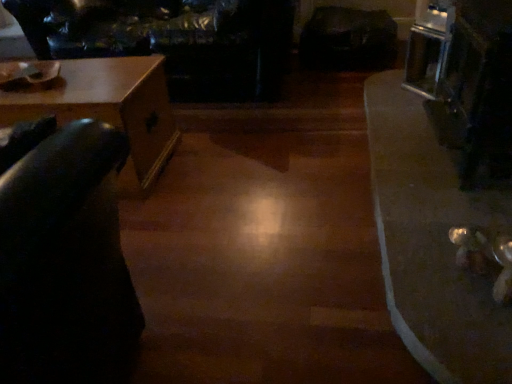
Locate an element on the screen. This screenshot has width=512, height=384. leather couch at upper left is located at coordinates (172, 40).

The width and height of the screenshot is (512, 384). What are the coordinates of `wooden table at left, the first table from the left` in the screenshot? It's located at (109, 109).

Is shiny metallic table at lower right, the 1th table from the right, positioned beyond the bounds of leather couch at upper left?

Yes, shiny metallic table at lower right, the 1th table from the right, is outside of leather couch at upper left.

Measure the distance between shiny metallic table at lower right, the 1th table from the right, and leather couch at upper left.

A distance of 4.32 feet exists between shiny metallic table at lower right, the 1th table from the right, and leather couch at upper left.

Is shiny metallic table at lower right, the 1th table from the right, facing away from leather couch at upper left?

That's not correct — shiny metallic table at lower right, the 1th table from the right, is not looking away from leather couch at upper left.

Does shiny metallic table at lower right, the 1th table from the right, lie behind leather couch at upper left?

No.

Measure the distance from wooden table at left, the first table from the left, to leather couch at upper left.

wooden table at left, the first table from the left, is 25.36 inches away from leather couch at upper left.

Is wooden table at left, which is the second table from right to left, positioned beyond the bounds of leather couch at upper left?

Yes, wooden table at left, which is the second table from right to left, is outside of leather couch at upper left.

Looking at this image, considering the relative positions of wooden table at left, which is the second table from right to left, and leather couch at upper left in the image provided, is wooden table at left, which is the second table from right to left, to the left or to the right of leather couch at upper left?

In the image, wooden table at left, which is the second table from right to left, appears on the left side of leather couch at upper left.

Who is more distant, wooden table at left, the first table from the left, or leather couch at upper left?

leather couch at upper left is further away from the camera.

Is shiny metallic table at lower right, placed as the second table when sorted from left to right, bigger than wooden table at left, which is the second table from right to left?

No.

From the image's perspective, which one is positioned lower, shiny metallic table at lower right, the 1th table from the right, or wooden table at left, which is the second table from right to left?

shiny metallic table at lower right, the 1th table from the right, from the image's perspective.

Between shiny metallic table at lower right, placed as the second table when sorted from left to right, and wooden table at left, the first table from the left, which one appears on the right side from the viewer's perspective?

shiny metallic table at lower right, placed as the second table when sorted from left to right, is more to the right.

What's the angular difference between wooden table at left, the first table from the left, and shiny metallic table at lower right, the 1th table from the right,'s facing directions?

The angle between the facing direction of wooden table at left, the first table from the left, and the facing direction of shiny metallic table at lower right, the 1th table from the right, is 89.2 degrees.

In terms of size, does wooden table at left, the first table from the left, appear bigger or smaller than shiny metallic table at lower right, placed as the second table when sorted from left to right?

Clearly, wooden table at left, the first table from the left, is larger in size than shiny metallic table at lower right, placed as the second table when sorted from left to right.

Is point (146, 90) behind point (437, 151)?

No.

Can you confirm if wooden table at left, the first table from the left, is shorter than shiny metallic table at lower right, the 1th table from the right?

No.

Is leather couch at upper left wider than wooden table at left, the first table from the left?

Correct, the width of leather couch at upper left exceeds that of wooden table at left, the first table from the left.

From the image's perspective, between leather couch at upper left and wooden table at left, which is the second table from right to left, which one is located above?

From the image's view, leather couch at upper left is above.

Is leather couch at upper left oriented towards wooden table at left, which is the second table from right to left?

Yes, leather couch at upper left is oriented towards wooden table at left, which is the second table from right to left.

From the picture: Who is bigger, leather couch at upper left or wooden table at left, the first table from the left?

With larger size is leather couch at upper left.

Between leather couch at upper left and shiny metallic table at lower right, placed as the second table when sorted from left to right, which one appears on the left side from the viewer's perspective?

Positioned to the left is leather couch at upper left.

Where is `couch behind the shiny metallic table at lower right, the 1th table from the right`? Image resolution: width=512 pixels, height=384 pixels. couch behind the shiny metallic table at lower right, the 1th table from the right is located at coordinates (172, 40).

Is point (36, 38) more distant than point (438, 237)?

Yes, point (36, 38) is behind point (438, 237).

In the scene shown: From a real-world perspective, relative to shiny metallic table at lower right, the 1th table from the right, is leather couch at upper left vertically above or below?

leather couch at upper left is above shiny metallic table at lower right, the 1th table from the right.

Where is `couch above the shiny metallic table at lower right, placed as the second table when sorted from left to right (from a real-world perspective)`? couch above the shiny metallic table at lower right, placed as the second table when sorted from left to right (from a real-world perspective) is located at coordinates (172, 40).

Locate an element on the screen. table to the left of leather couch at upper left is located at coordinates (109, 109).

When comparing their distances from shiny metallic table at lower right, placed as the second table when sorted from left to right, does wooden table at left, which is the second table from right to left, or leather couch at upper left seem further?

Based on the image, leather couch at upper left appears to be further to shiny metallic table at lower right, placed as the second table when sorted from left to right.

Looking at the image, which one is located closer to leather couch at upper left, shiny metallic table at lower right, the 1th table from the right, or wooden table at left, which is the second table from right to left?

wooden table at left, which is the second table from right to left.

Based on their spatial positions, is leather couch at upper left or shiny metallic table at lower right, placed as the second table when sorted from left to right, closer to wooden table at left, the first table from the left?

leather couch at upper left is positioned closer to the anchor wooden table at left, the first table from the left.

Looking at this image, estimate the real-world distances between objects in this image. Which object is closer to leather couch at upper left, wooden table at left, which is the second table from right to left, or shiny metallic table at lower right, the 1th table from the right?

Based on the image, wooden table at left, which is the second table from right to left, appears to be nearer to leather couch at upper left.

Which object lies nearer to the anchor point shiny metallic table at lower right, placed as the second table when sorted from left to right, leather couch at upper left or wooden table at left, the first table from the left?

wooden table at left, the first table from the left, is closer to shiny metallic table at lower right, placed as the second table when sorted from left to right.

Which object lies further to the anchor point wooden table at left, which is the second table from right to left, shiny metallic table at lower right, placed as the second table when sorted from left to right, or leather couch at upper left?

shiny metallic table at lower right, placed as the second table when sorted from left to right, is positioned further to the anchor wooden table at left, which is the second table from right to left.

You are a GUI agent. You are given a task and a screenshot of the screen. Output one action in this format:
    pyautogui.click(x=<x>, y=<y>)
    Task: Click on the couch located between wooden table at left, which is the second table from right to left, and shiny metallic table at lower right, the 1th table from the right, in the left-right direction
    The width and height of the screenshot is (512, 384).
    Given the screenshot: What is the action you would take?
    pyautogui.click(x=172, y=40)